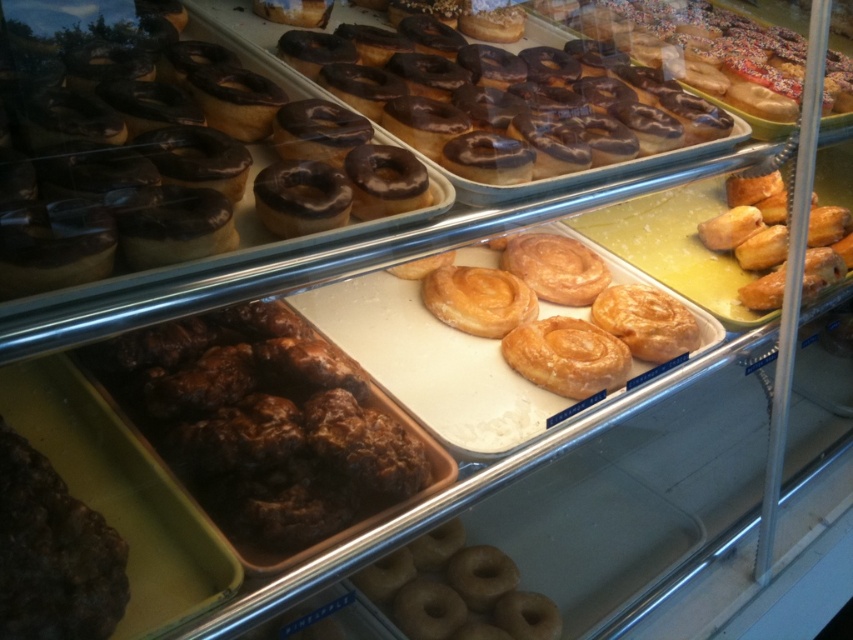
You are a customer at the bakery and want to point out the dark brown crumbly pastry at lower left to the cashier. However, you can only describe its position relative to the chocolate glazed donuts at upper center. How would you describe its location?

The dark brown crumbly pastry at lower left is located behind the chocolate glazed donuts at upper center.

You are a customer trying to choose between the shiny chocolate donut at upper left and the golden glazed pastry at center. Based on their sizes, which one do you think is wider?

The shiny chocolate donut at upper left might be wider than golden glazed pastry at center according to the description.